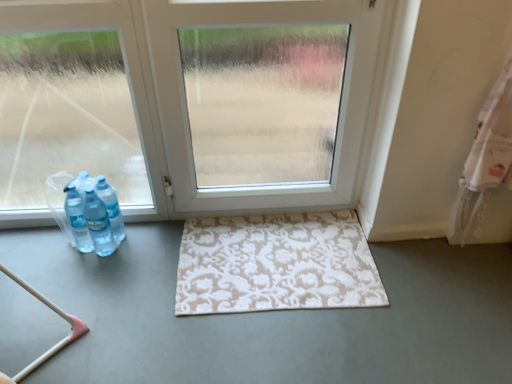
This screenshot has width=512, height=384. I want to click on empty space that is in between white matte door at center and translucent plastic bottles at left, so click(194, 234).